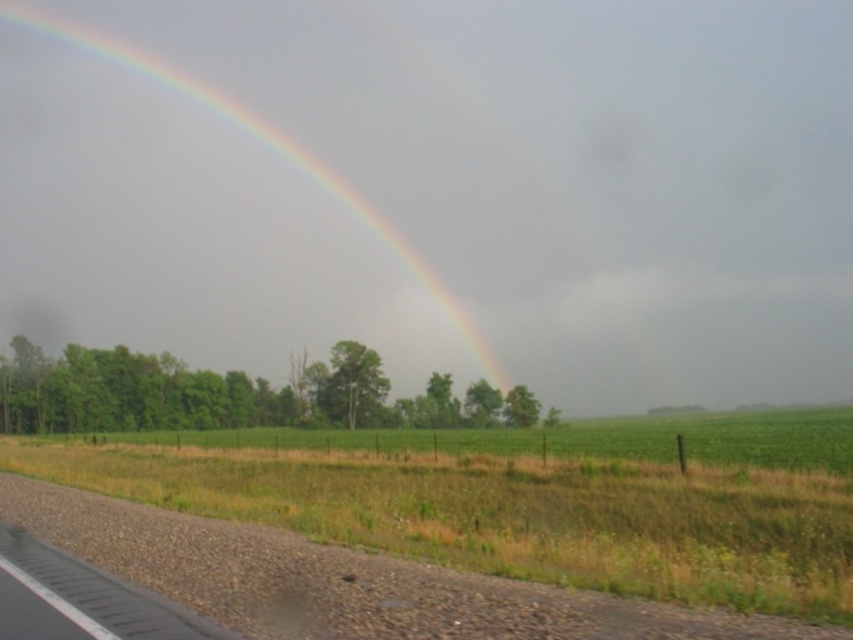
You are a photographer planning to capture the rainbow at upper center and green grass at lower center in a single frame. Considering their widths, which object will occupy more space horizontally in the photo?

The rainbow at upper center will occupy more space horizontally in the photo because its width surpasses that of the green grass at lower center.